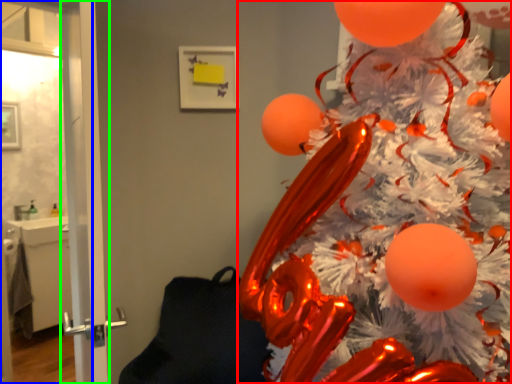
Question: Which object is the farthest from christmas tree (highlighted by a red box)? Choose among these: screen door (highlighted by a blue box) or screen door (highlighted by a green box).

Choices:
 (A) screen door
 (B) screen door

Answer: (B)